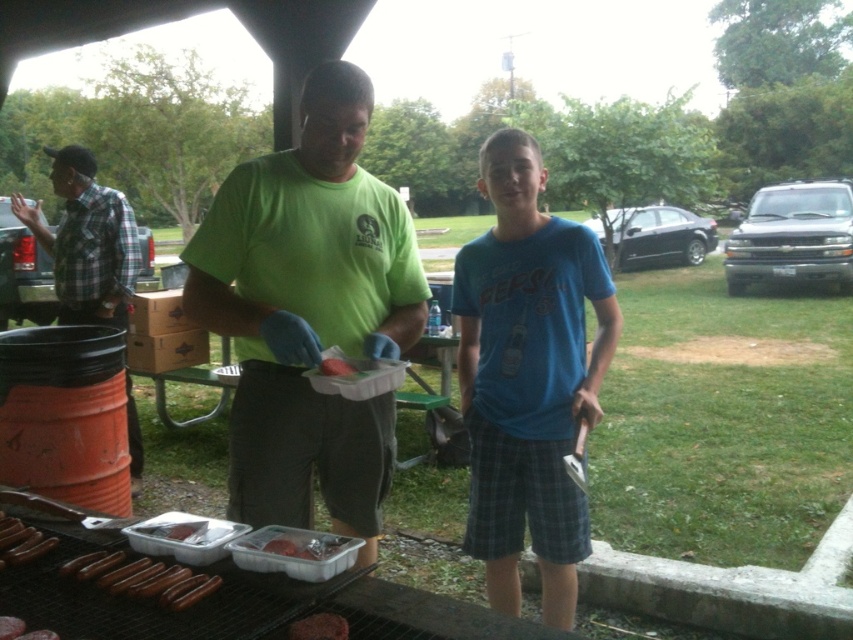
Question: Among these objects, which one is farthest from the camera?

Choices:
 (A) smooth white meat at center
 (B) plaid fabric shirt at left
 (C) smooth plastic container at grill front

Answer: (B)

Question: Which object is the closest to the smooth brown meat at center?

Choices:
 (A) brown matte hot dog at lower left
 (B) blue cotton t-shirt at center

Answer: (A)

Question: Is plaid fabric shirt at left positioned in front of brown matte hot dog at lower left?

Choices:
 (A) no
 (B) yes

Answer: (A)

Question: Can you confirm if brown matte hot dog at lower left is smaller than smooth white meat at center?

Choices:
 (A) no
 (B) yes

Answer: (A)

Question: Does green matte shirt at center come behind smooth plastic container at grill front?

Choices:
 (A) no
 (B) yes

Answer: (B)

Question: Which object is positioned closest to the shiny brown hot dogs at lower left?

Choices:
 (A) plaid fabric shirt at left
 (B) green matte shirt at center
 (C) brown matte hot dog at lower left

Answer: (C)